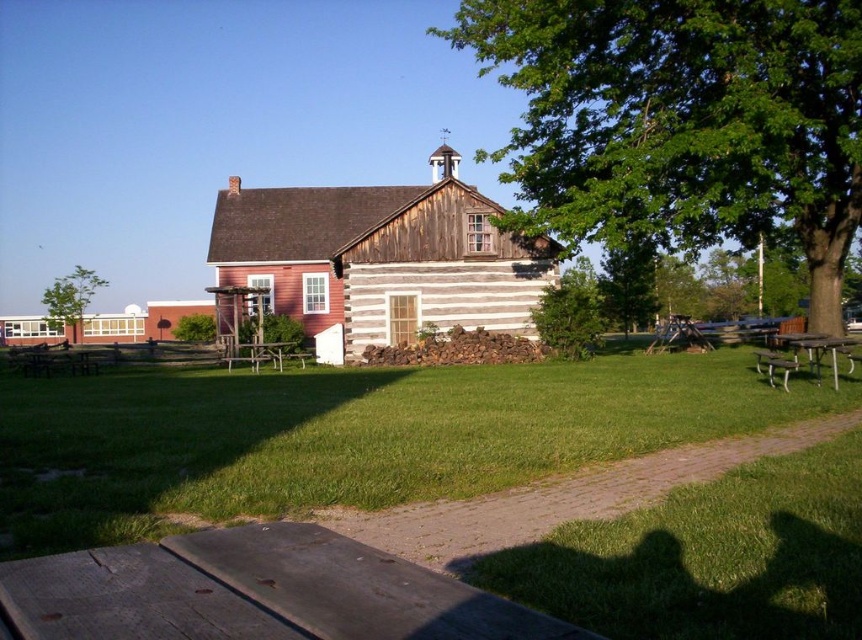
Is green textured log cabin at center thinner than white plastic park bench at lower right?

Yes, green textured log cabin at center is thinner than white plastic park bench at lower right.

Does green textured log cabin at center have a lesser height compared to white plastic park bench at lower right?

Indeed, green textured log cabin at center has a lesser height compared to white plastic park bench at lower right.

Image resolution: width=862 pixels, height=640 pixels. What do you see at coordinates (570, 312) in the screenshot?
I see `green textured log cabin at center` at bounding box center [570, 312].

Where is `green textured log cabin at center`? green textured log cabin at center is located at coordinates (570, 312).

Is point (817, 364) less distant than point (233, 346)?

That is True.

Is black metal picnic table at lower right below white plastic picnic table at center?

Actually, black metal picnic table at lower right is above white plastic picnic table at center.

Does point (840, 353) come closer to viewer compared to point (286, 353)?

Yes, it is in front of point (286, 353).

Find the location of a particular element. The height and width of the screenshot is (640, 862). black metal picnic table at lower right is located at coordinates [823, 352].

Does green leafy tree at left appear under metallic silver park bench at lower right?

Actually, green leafy tree at left is above metallic silver park bench at lower right.

Describe the element at coordinates (72, 296) in the screenshot. The width and height of the screenshot is (862, 640). I see `green leafy tree at left` at that location.

Between point (59, 285) and point (784, 385), which one is positioned behind?

The point (59, 285) is behind.

Where is `green leafy tree at left`? green leafy tree at left is located at coordinates (72, 296).